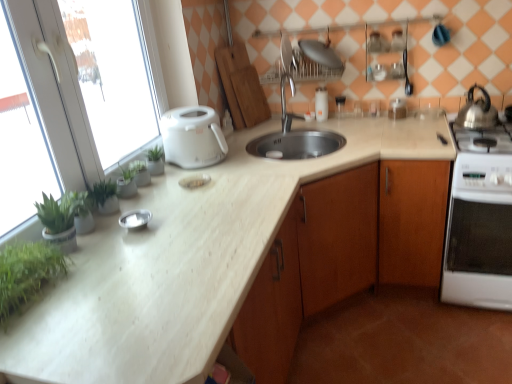
In order to click on free space to the left of silver metallic bowl at center, which ranks as the fourth appliance in back-to-front order in this screenshot , I will do `click(105, 228)`.